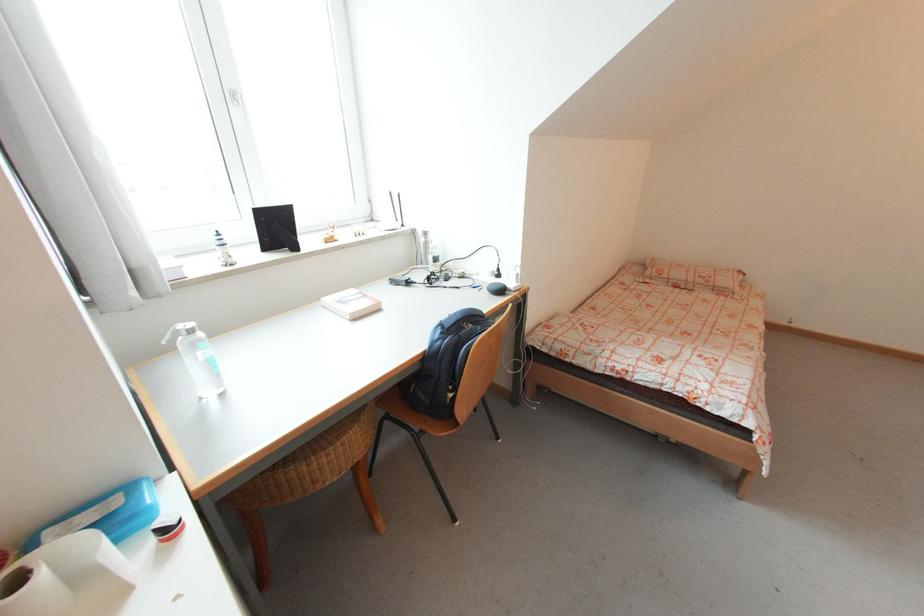
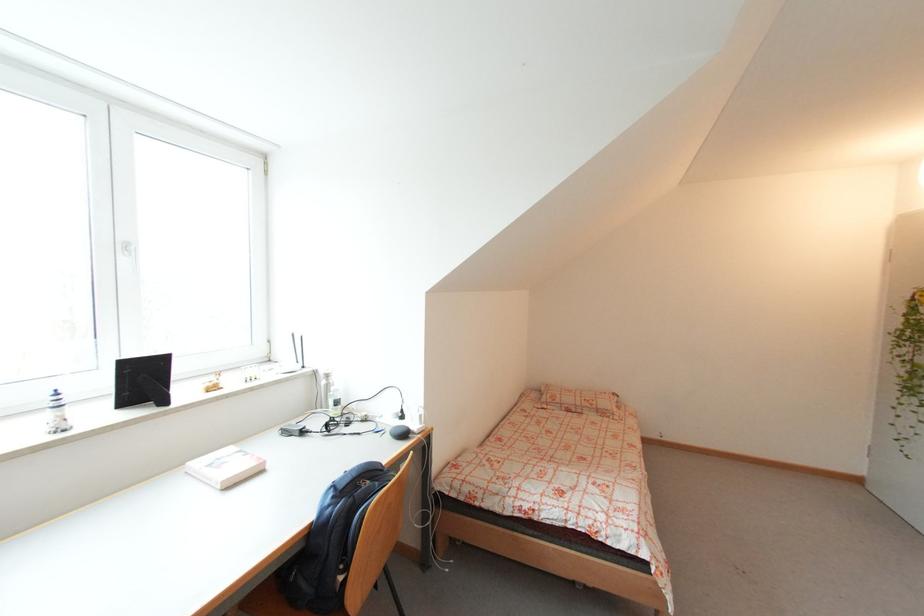
Find the pixel in the second image that matches pixel 221 233 in the first image.

(58, 392)